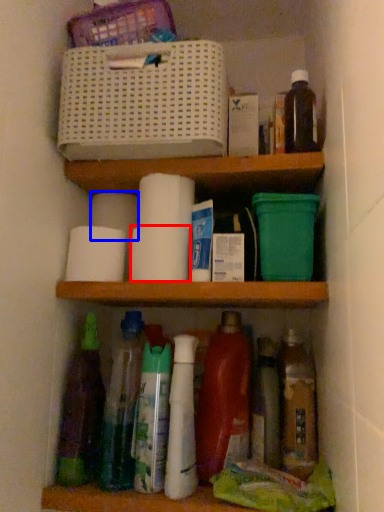
Question: Which point is further to the camera, toilet paper (highlighted by a red box) or toilet paper (highlighted by a blue box)?

Choices:
 (A) toilet paper
 (B) toilet paper

Answer: (B)